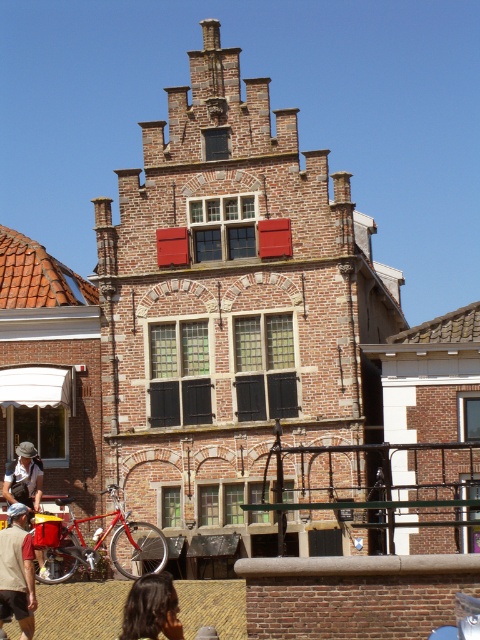
You are a photographer standing in front of a historic brick building with a red roof. You notice two features at the lower left corner of the building. One is dark brown hair at lower left, and the other is white cotton shirt at lower left. Which one is closer to the ground?

The dark brown hair at lower left is below the white cotton shirt at lower left, so it is closer to the ground.

Consider the image. You are a delivery person with a 30 feet long ladder. You need to place the ladder from the shiny red bicycle at lower left to the black matte shutters at center to reach the window. Will the ladder be long enough?

The distance between the shiny red bicycle at lower left and the black matte shutters at center is 31.22 feet. Since the ladder is only 30 feet long, it is not long enough to span the distance between the shiny red bicycle at lower left and the black matte shutters at center.